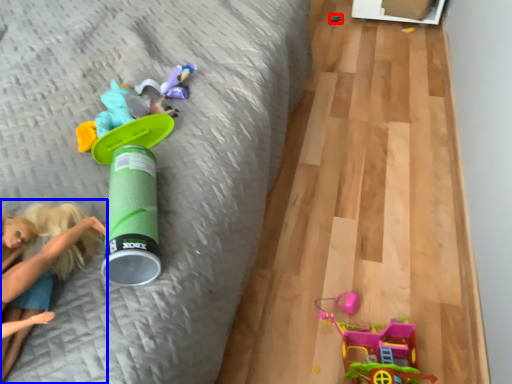
Question: Among these objects, which one is nearest to the camera, toy (highlighted by a red box) or person (highlighted by a blue box)?

Choices:
 (A) toy
 (B) person

Answer: (B)